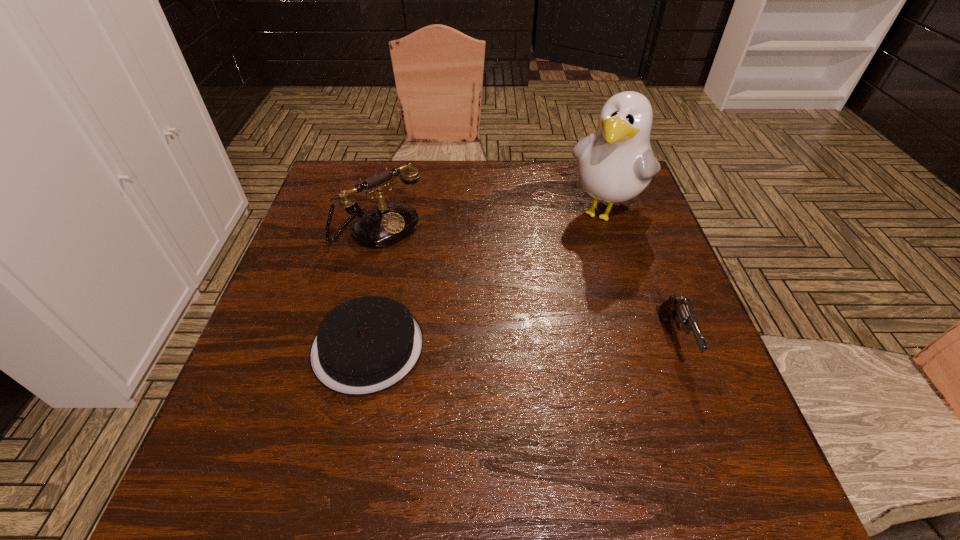
Find the location of a particular element. The width and height of the screenshot is (960, 540). the shortest object is located at coordinates (366, 345).

The height and width of the screenshot is (540, 960). I want to click on the second shortest object, so click(676, 308).

Locate an element on the screen. The height and width of the screenshot is (540, 960). telephone is located at coordinates (387, 224).

Identify the location of gull. The height and width of the screenshot is (540, 960). (615, 163).

Image resolution: width=960 pixels, height=540 pixels. I want to click on vacant space situated 0.260m on the back of the shortest object, so click(x=393, y=230).

Find the location of a particular element. The height and width of the screenshot is (540, 960). vacant space located at the barrel of the third tallest object is located at coordinates (696, 401).

Locate an element on the screen. vacant region located on the dial of the telephone is located at coordinates (420, 259).

At what (x,y) coordinates should I click in order to perform the action: click on blank space located on the dial of the telephone. Please return your answer as a coordinate pair (x, y). The height and width of the screenshot is (540, 960). Looking at the image, I should click on pyautogui.click(x=465, y=298).

The image size is (960, 540). In order to click on vacant space located on the dial of the telephone in this screenshot , I will do `click(456, 291)`.

Find the location of a particular element. vacant space situated 0.120m on the beak of the gull is located at coordinates (x=569, y=263).